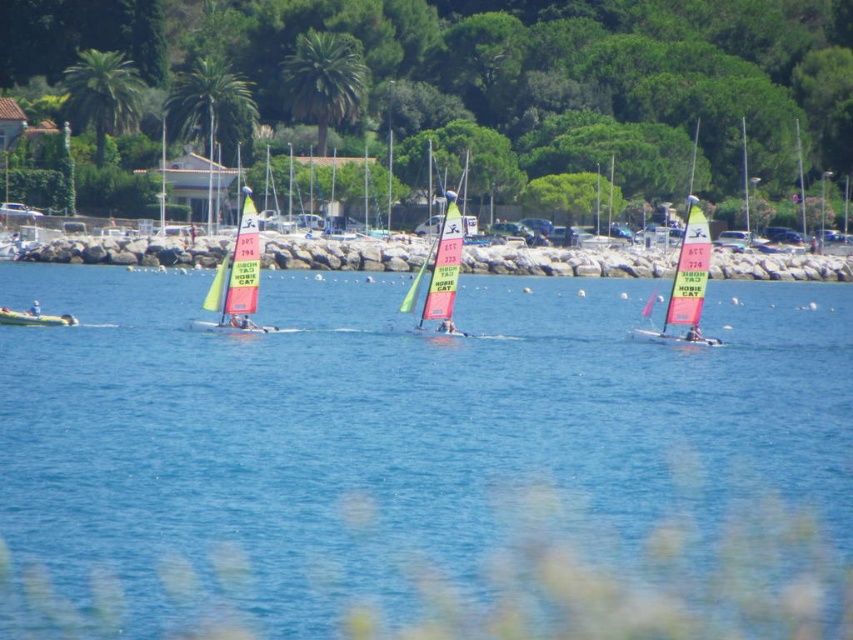
You are a photographer aiming to capture both the yellow matte kayak at left and the white plastic kayak at left in a single shot. Since they are both on the left side of the image, which kayak is closer to the center of the image?

The yellow matte kayak at left is positioned on the right side of the white plastic kayak at left, so it is closer to the center of the image than the white plastic kayak at left.

You are standing on the rocky shoreline observing the sailboats. There are two points marked on the water surface. One is at coordinate point (821, 400) and the other at point (247, 250). Which point is nearer to your current position on the shoreline?

Point (821, 400) is closer to the viewer than point (247, 250), so the point at coordinate (821, 400) is nearer to your current position on the shoreline.